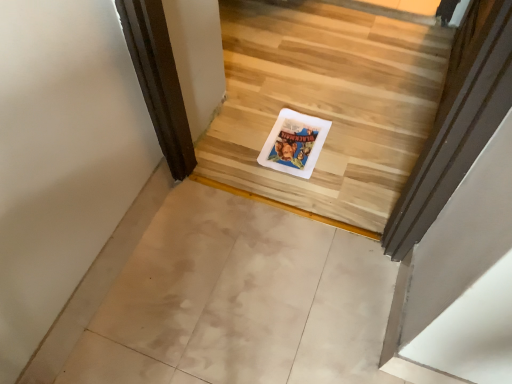
This screenshot has height=384, width=512. Find the location of `white matte comic book at center`. white matte comic book at center is located at coordinates (294, 143).

This screenshot has width=512, height=384. What do you see at coordinates (294, 143) in the screenshot? I see `white matte comic book at center` at bounding box center [294, 143].

Measure the distance between point (307, 167) and camera.

Point (307, 167) and camera are 1.55 meters apart from each other.

What is the approximate width of white matte comic book at center?

white matte comic book at center is 13.04 inches wide.

You are a GUI agent. You are given a task and a screenshot of the screen. Output one action in this format:
    pyautogui.click(x=<x>, y=<y>)
    Task: Click on the white matte comic book at center
    The height and width of the screenshot is (384, 512).
    Given the screenshot: What is the action you would take?
    (294, 143)